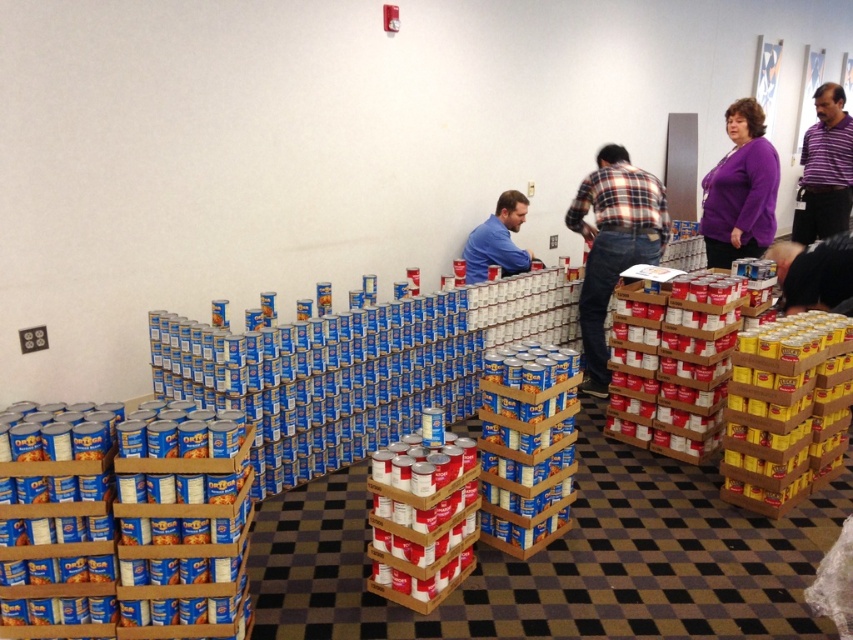
Is purple matte shirt at upper right positioned behind black matte shirt at lower right?

Yes, it is.

Does purple matte shirt at upper right appear on the left side of black matte shirt at lower right?

No, purple matte shirt at upper right is not to the left of black matte shirt at lower right.

Which is behind, point (706, 200) or point (820, 282)?

Point (706, 200)

I want to click on purple matte shirt at upper right, so click(740, 189).

From the picture: Can you confirm if purple striped polo shirt at upper right is positioned below blue shirt at center?

Actually, purple striped polo shirt at upper right is above blue shirt at center.

Is purple striped polo shirt at upper right wider than blue shirt at center?

No.

Locate an element on the screen. This screenshot has height=640, width=853. purple striped polo shirt at upper right is located at coordinates (824, 170).

Is purple striped polo shirt at upper right wider than black matte shirt at lower right?

Yes, purple striped polo shirt at upper right is wider than black matte shirt at lower right.

Is point (828, 128) positioned after point (838, 275)?

Yes, it is behind point (838, 275).

Find the location of a particular element. purple striped polo shirt at upper right is located at coordinates (824, 170).